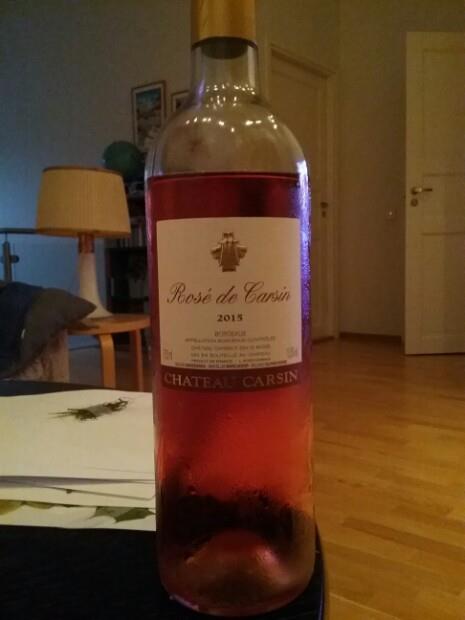
Find the location of a particular element. The image size is (465, 620). gray pillow is located at coordinates (51, 312).